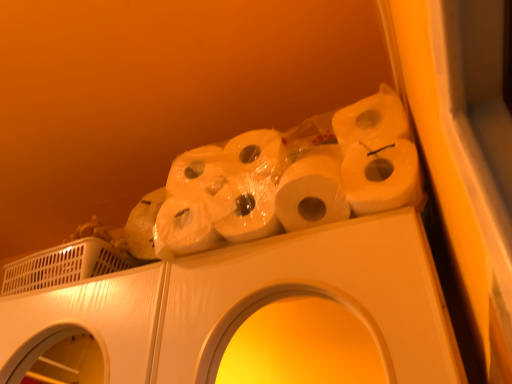
Question: Are white plastic washing machine at upper left and white matte toilet paper at upper center located far from each other?

Choices:
 (A) yes
 (B) no

Answer: (B)

Question: Is white plastic washing machine at upper left turned away from white matte toilet paper at upper center?

Choices:
 (A) no
 (B) yes

Answer: (A)

Question: From the image's perspective, is white plastic washing machine at upper left below white matte toilet paper at upper center?

Choices:
 (A) yes
 (B) no

Answer: (A)

Question: From the image's perspective, is white plastic washing machine at upper left located above white matte toilet paper at upper center?

Choices:
 (A) no
 (B) yes

Answer: (A)

Question: Does white plastic washing machine at upper left appear on the right side of white matte toilet paper at upper center?

Choices:
 (A) yes
 (B) no

Answer: (B)

Question: From a real-world perspective, is white plastic washing machine at upper left on top of white matte toilet paper at upper center?

Choices:
 (A) yes
 (B) no

Answer: (B)

Question: Would you say white plastic washing machine at upper left is part of white matte toilet paper at upper center's contents?

Choices:
 (A) yes
 (B) no

Answer: (B)

Question: From the image's perspective, is white matte toilet paper at upper center located beneath white plastic washing machine at upper left?

Choices:
 (A) no
 (B) yes

Answer: (A)

Question: Are white matte toilet paper at upper center and white plastic washing machine at upper left making contact?

Choices:
 (A) no
 (B) yes

Answer: (A)

Question: Considering the relative sizes of white matte toilet paper at upper center and white plastic washing machine at upper left in the image provided, is white matte toilet paper at upper center bigger than white plastic washing machine at upper left?

Choices:
 (A) no
 (B) yes

Answer: (B)

Question: Considering the relative positions of white matte toilet paper at upper center and white plastic washing machine at upper left in the image provided, is white matte toilet paper at upper center in front of white plastic washing machine at upper left?

Choices:
 (A) no
 (B) yes

Answer: (B)

Question: Is white matte toilet paper at upper center to the right of white plastic washing machine at upper left from the viewer's perspective?

Choices:
 (A) no
 (B) yes

Answer: (B)

Question: Is white plastic washing machine at upper left in front of or behind white matte toilet paper at upper center in the image?

Choices:
 (A) behind
 (B) front

Answer: (A)